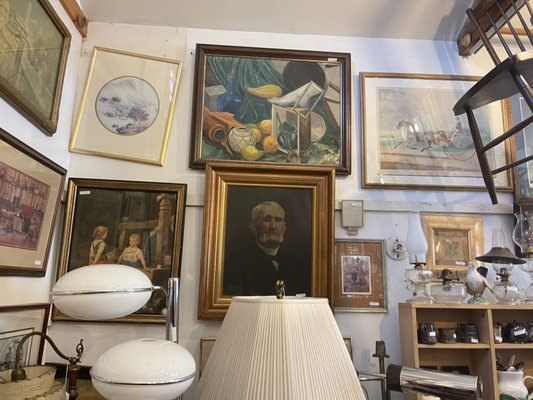
Identify the location of space age looking lamp shades. (91, 280), (160, 362).